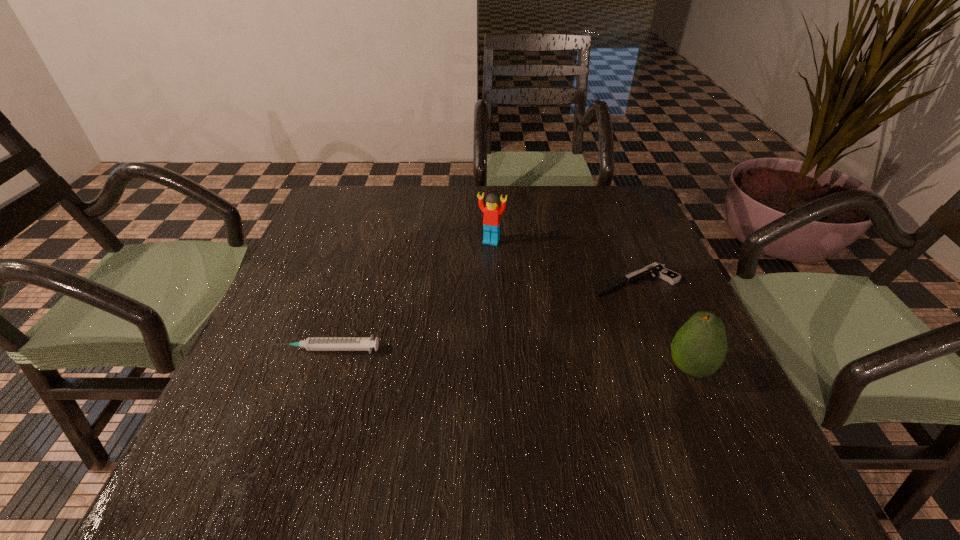
Where is `vacant area that lies between the pistol and the avocado`? The width and height of the screenshot is (960, 540). vacant area that lies between the pistol and the avocado is located at coordinates (661, 325).

Find the location of `free space between the second farthest object and the syringe`. free space between the second farthest object and the syringe is located at coordinates (480, 315).

You are a GUI agent. You are given a task and a screenshot of the screen. Output one action in this format:
    pyautogui.click(x=<x>, y=<y>)
    Task: Click on the vacant region between the avocado and the Lego
    
    Given the screenshot: What is the action you would take?
    pyautogui.click(x=590, y=305)

The height and width of the screenshot is (540, 960). In order to click on vacant area that lies between the avocado and the Lego in this screenshot , I will do `click(590, 305)`.

The width and height of the screenshot is (960, 540). Identify the location of object that is the second closest to the avocado. (491, 221).

The height and width of the screenshot is (540, 960). Find the location of `the third closest object relative to the third tallest object`. the third closest object relative to the third tallest object is located at coordinates (699, 348).

Where is `vacant position in the image that satisfies the following two spatial constraints: 1. on the front side of the avocado; 2. on the right side of the shortest object`? vacant position in the image that satisfies the following two spatial constraints: 1. on the front side of the avocado; 2. on the right side of the shortest object is located at coordinates (669, 368).